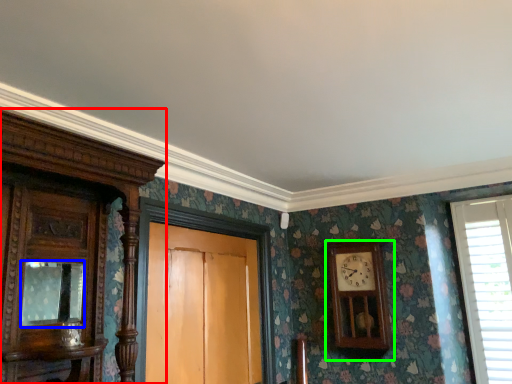
Question: Which object is the closest to the cabinetry (highlighted by a red box)? Choose among these: mirror (highlighted by a blue box) or wall clock (highlighted by a green box).

Choices:
 (A) mirror
 (B) wall clock

Answer: (A)